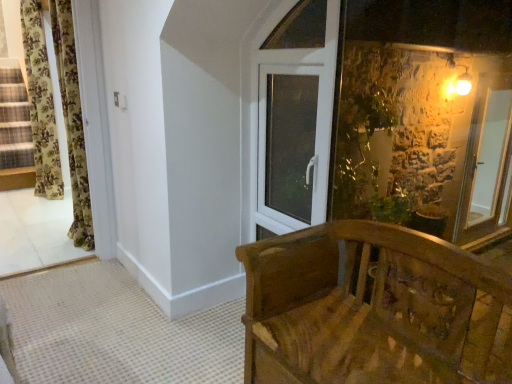
Question: Is point (259, 274) positioned closer to the camera than point (307, 139)?

Choices:
 (A) closer
 (B) farther

Answer: (A)

Question: Considering the positions of wooden carved bench at lower right and white plastic window at upper center in the image, is wooden carved bench at lower right wider or thinner than white plastic window at upper center?

Choices:
 (A) wide
 (B) thin

Answer: (A)

Question: Estimate the real-world distances between objects in this image. Which object is closer to the floral fabric curtain at left, arranged as the 2th curtain when viewed from the left?

Choices:
 (A) white plastic window at upper center
 (B) floral fabric curtain at left, arranged as the first curtain when viewed from the left
 (C) wooden carved bench at lower right

Answer: (B)

Question: Which object is the closest to the white plastic window at upper center?

Choices:
 (A) wooden carved bench at lower right
 (B) floral fabric curtain at left, which is the first curtain from right to left
 (C) floral fabric curtain at left, which is the second curtain from front to back

Answer: (A)